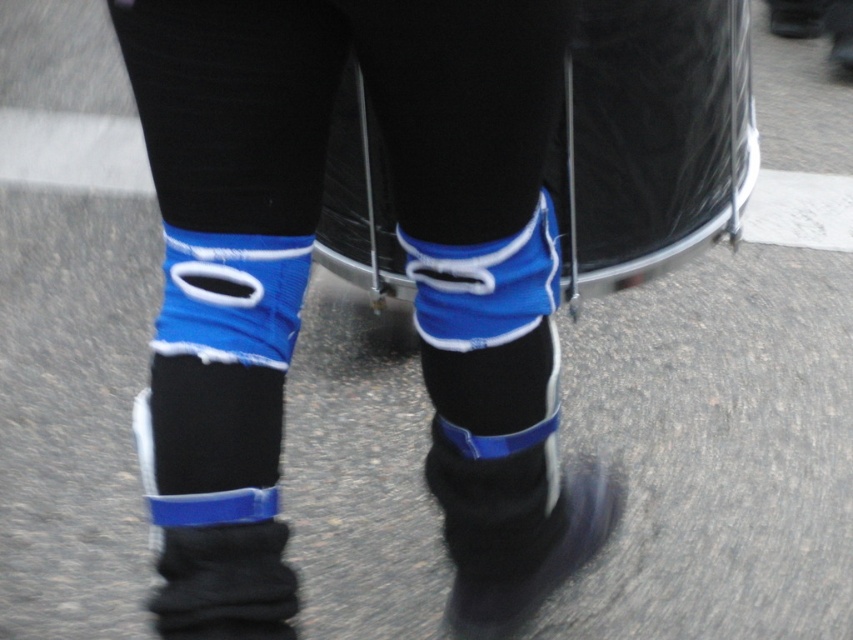
You are a physical therapist analyzing the positioning of two points on a patient. The points are labeled as point (453,604) and point (575,490). Based on the image, which point is closer to the viewer?

Point (453,604) is in front of point (575,490), so it is closer to the viewer.

You are trying to decide which footwear to choose for a walk. You have the black knitted socks at lower left and the black matte boot at lower center. Based on their height, which one would provide better ankle support?

The black matte boot at lower center is taller than the black knitted socks at lower left, so it would provide better ankle support.

You are a fashion designer trying to create a coordinated outfit. You have the blue fabric leg warmers at center and the black knitted socks at lower left. Which one should you choose to emphasize a larger, more prominent feature in the design?

The blue fabric leg warmers at center is larger in size than the black knitted socks at lower left, so choosing the blue fabric leg warmers at center would emphasize a larger, more prominent feature in the design.